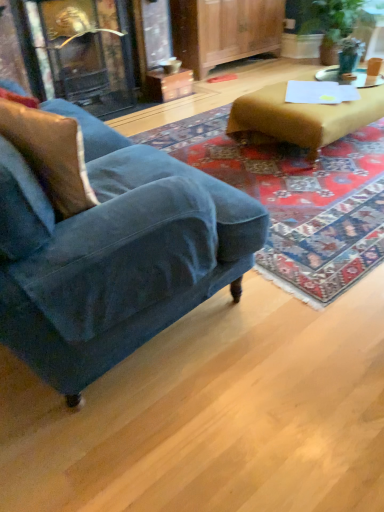
The width and height of the screenshot is (384, 512). Identify the location of unoccupied area in front of teal glass at upper right. (340, 79).